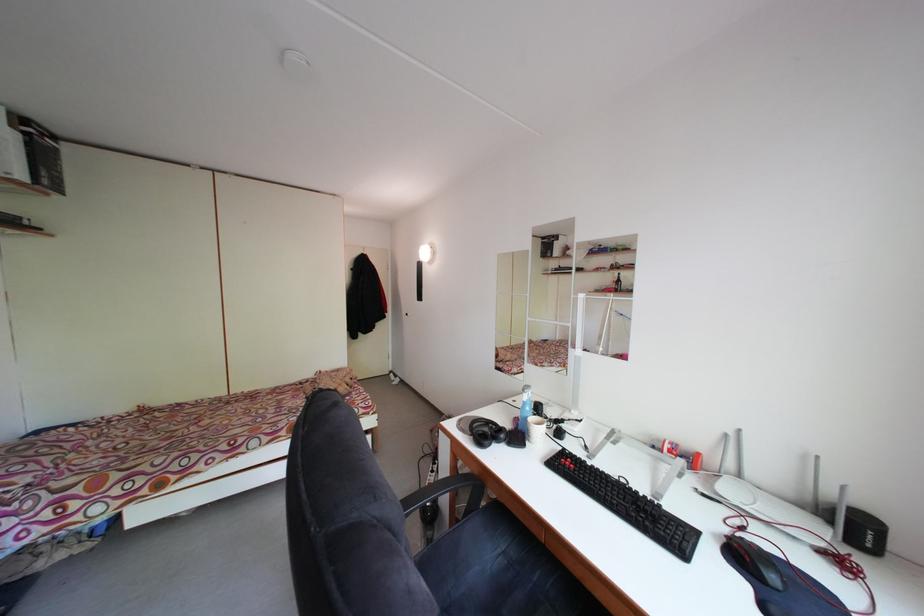
What do you see at coordinates (488, 570) in the screenshot? I see `a chair sitting surface` at bounding box center [488, 570].